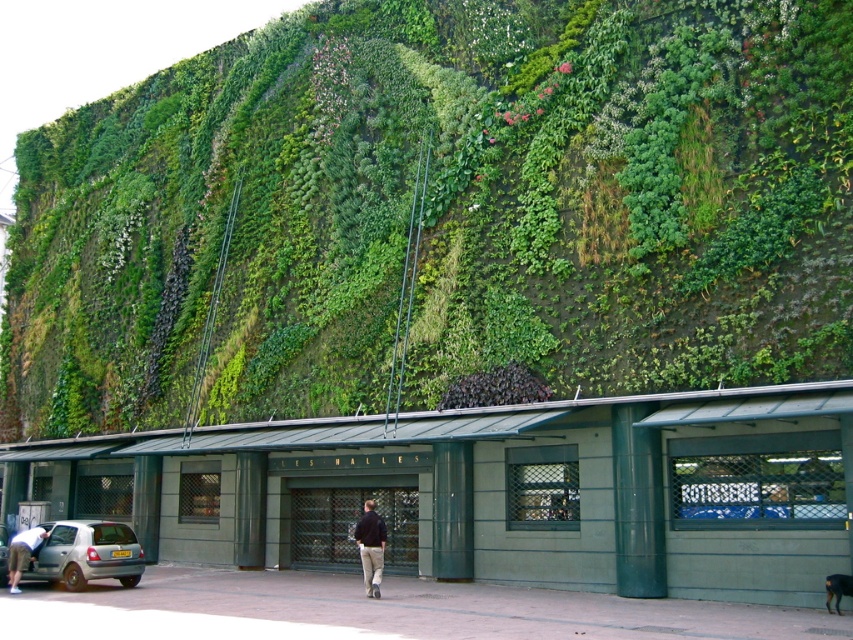
Is green leafy wall at upper center further to the viewer compared to green concrete shed at center?

Yes.

Is point (315, 132) farther from viewer compared to point (532, 486)?

Yes, it is.

You are a GUI agent. You are given a task and a screenshot of the screen. Output one action in this format:
    pyautogui.click(x=<x>, y=<y>)
    Task: Click on the green leafy wall at upper center
    This screenshot has width=853, height=640.
    Given the screenshot: What is the action you would take?
    pyautogui.click(x=440, y=211)

At what (x,y) coordinates should I click in order to perform the action: click on green concrete shed at center. Please return your answer as a coordinate pair (x, y). The width and height of the screenshot is (853, 640). Looking at the image, I should click on (497, 490).

Who is positioned more to the right, light brown leather jacket at lower left or silver metallic car at lower left?

Positioned to the right is silver metallic car at lower left.

The height and width of the screenshot is (640, 853). Describe the element at coordinates (22, 554) in the screenshot. I see `light brown leather jacket at lower left` at that location.

I want to click on light brown leather jacket at lower left, so click(22, 554).